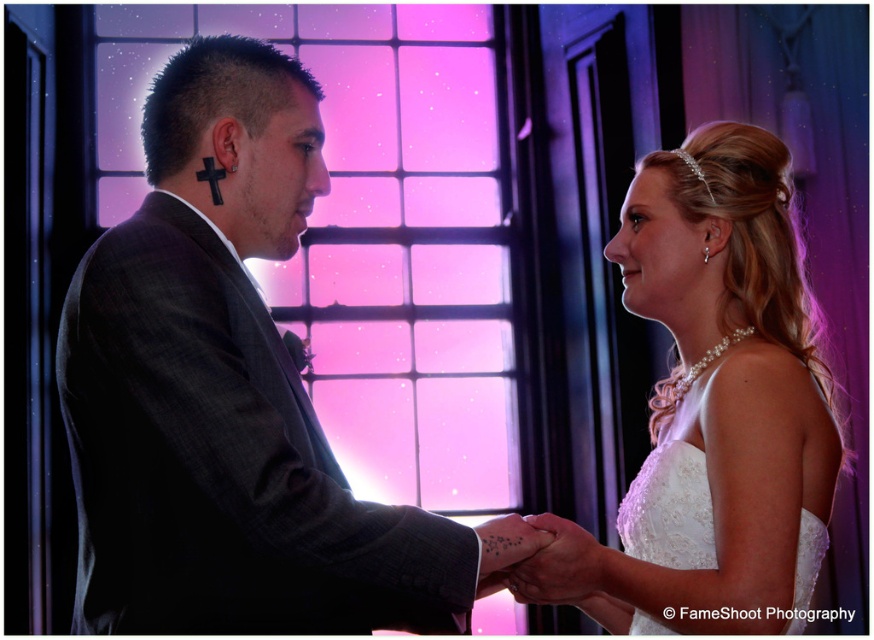
You are a photographer at a wedding. You need to position the matte black suit at left and the white lace wedding dress at right so that both are visible in the frame. Considering their heights, which subject should you adjust to ensure proper framing?

The matte black suit at left is taller than the white lace wedding dress at right. To ensure proper framing, you should adjust the camera angle or position to account for the height difference between the two subjects.

You are a photographer at the wedding. You need to adjust the lighting so that the white lace wedding dress at right and the matte black hand at center are both well lit. Which object should you focus on first to ensure proper exposure, considering their sizes?

The white lace wedding dress at right is taller than the matte black hand at center, so you should focus on the white lace wedding dress at right first to ensure proper exposure since it is larger and requires more light coverage.

You are a photographer at a wedding and need to capture the couple holding hands. The white lace dress at right and the matte black hand at center are in your frame. Based on their positions, which object is more to the right?

The white lace dress at right is positioned on the right side of the matte black hand at center, so the white lace dress at right is more to the right.